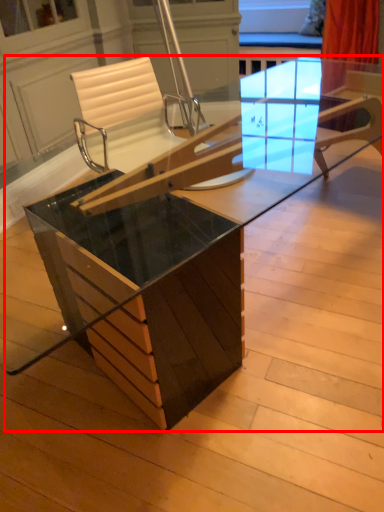
Question: From the image's perspective, what is the correct spatial positioning of table (annotated by the red box) in reference to chair?

Choices:
 (A) above
 (B) below

Answer: (B)